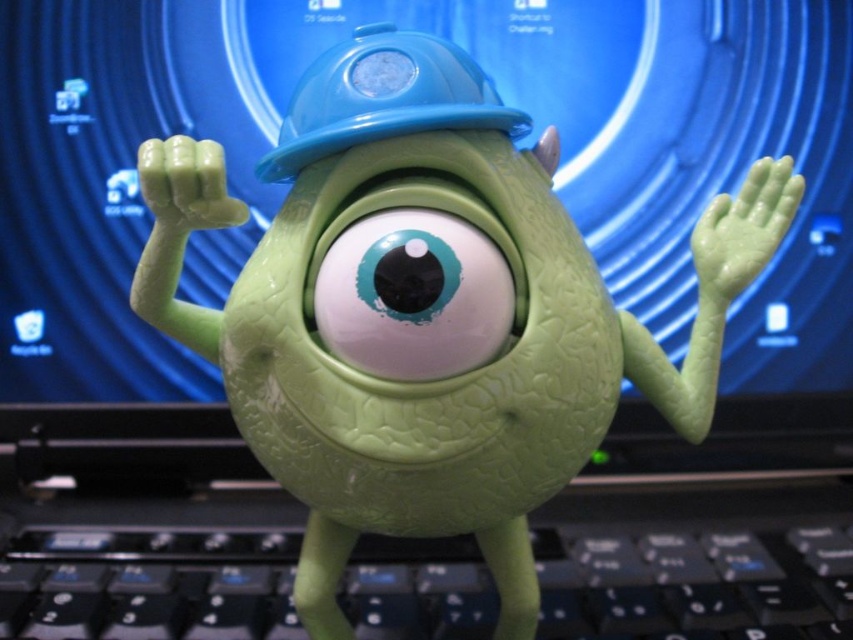
Is black plastic keyboard at center positioned in front of blue hard hat at center?

No, black plastic keyboard at center is behind blue hard hat at center.

Does black plastic keyboard at center have a greater height compared to blue hard hat at center?

No, black plastic keyboard at center is not taller than blue hard hat at center.

Where is `black plastic keyboard at center`? black plastic keyboard at center is located at coordinates (695, 579).

The width and height of the screenshot is (853, 640). What do you see at coordinates (695, 579) in the screenshot? I see `black plastic keyboard at center` at bounding box center [695, 579].

Is black plastic keyboard at center thinner than matte green eye at center?

In fact, black plastic keyboard at center might be wider than matte green eye at center.

At what (x,y) coordinates should I click in order to perform the action: click on black plastic keyboard at center. Please return your answer as a coordinate pair (x, y). This screenshot has width=853, height=640. Looking at the image, I should click on (695, 579).

Is matte green eye at center below blue hard hat at center?

Indeed, matte green eye at center is positioned under blue hard hat at center.

Identify the location of matte green eye at center. (412, 296).

The width and height of the screenshot is (853, 640). What do you see at coordinates (412, 296) in the screenshot?
I see `matte green eye at center` at bounding box center [412, 296].

Locate an element on the screen. matte green eye at center is located at coordinates (412, 296).